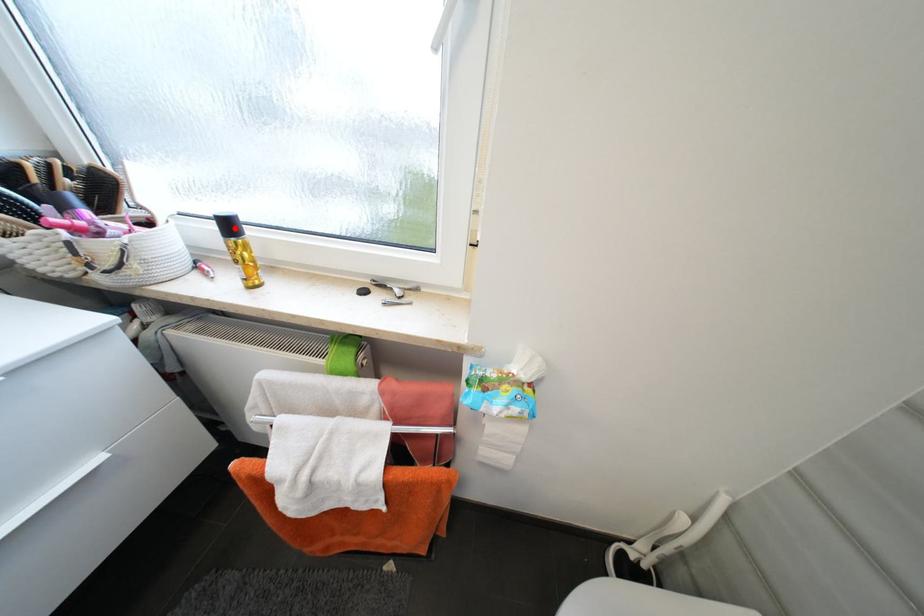
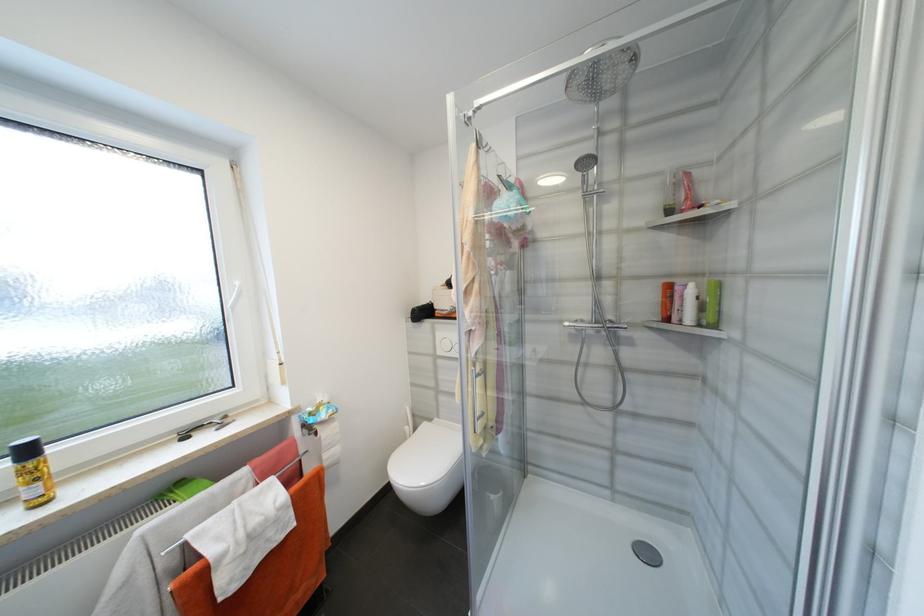
The point at the highlighted location is marked in the first image. Where is the corresponding point in the second image?

(33, 453)